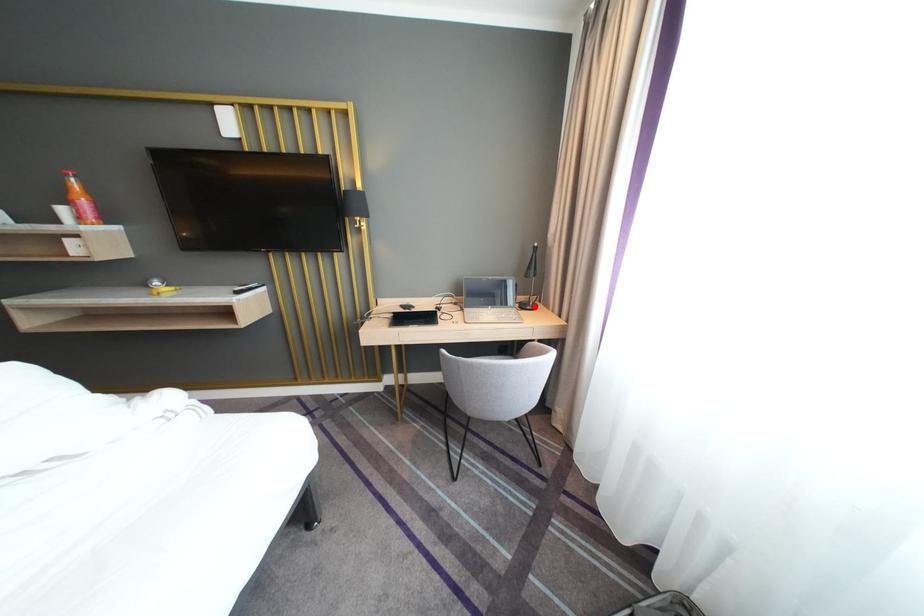
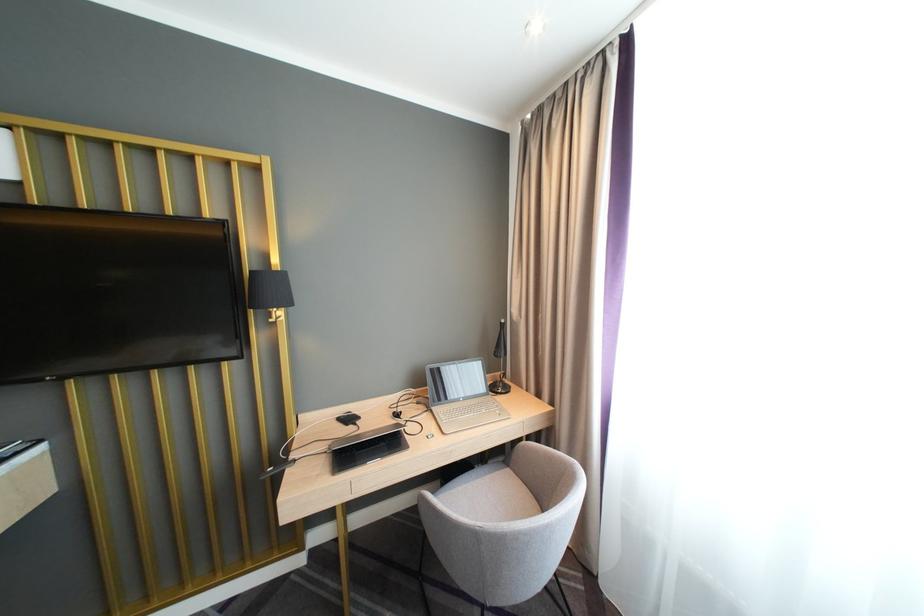
Locate, in the second image, the point that corresponds to the highlighted location in the first image.

(505, 390)